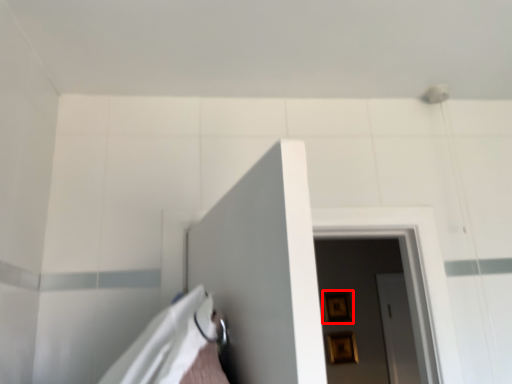
Question: From the image's perspective, where is picture frame (annotated by the red box) located relative to picture frame?

Choices:
 (A) below
 (B) above

Answer: (B)